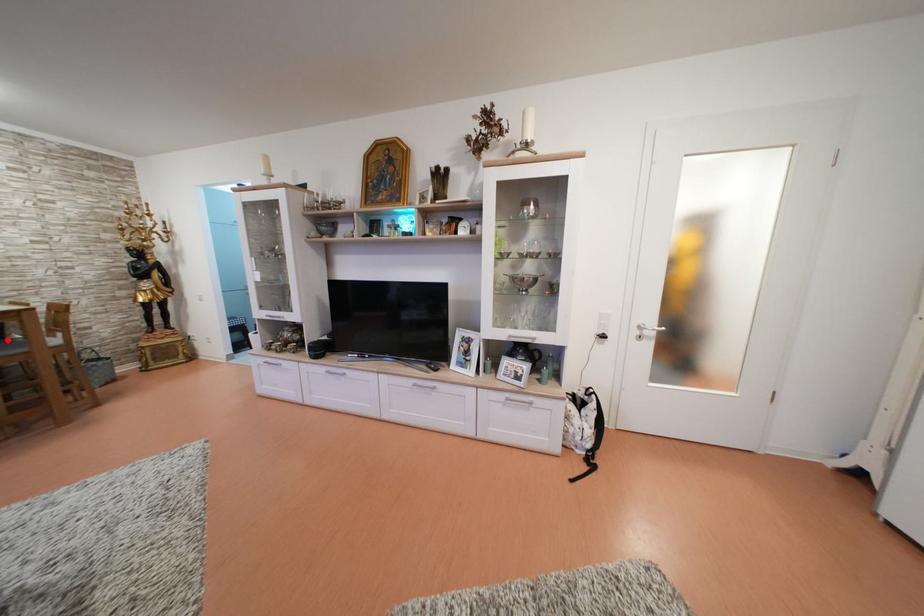
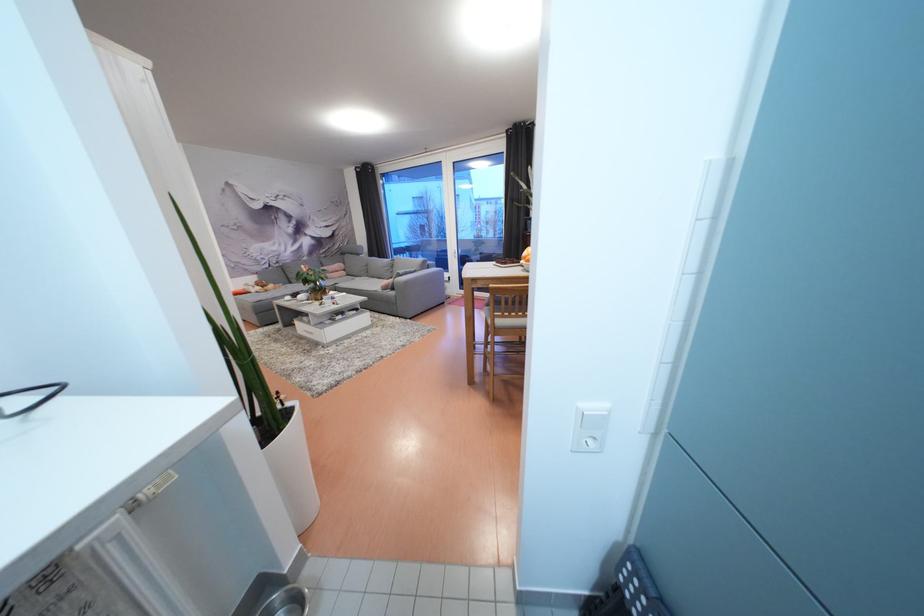
Question: I am providing you with two images of the same scene from different viewpoints. A red point is marked on the first image. Can you still see the location of the red point in image 2?

Choices:
 (A) Yes
 (B) No

Answer: (B)